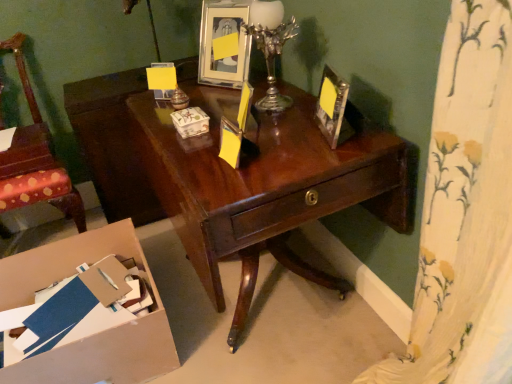
The width and height of the screenshot is (512, 384). In order to click on free space in front of matte ceramic box at center in this screenshot , I will do `click(190, 149)`.